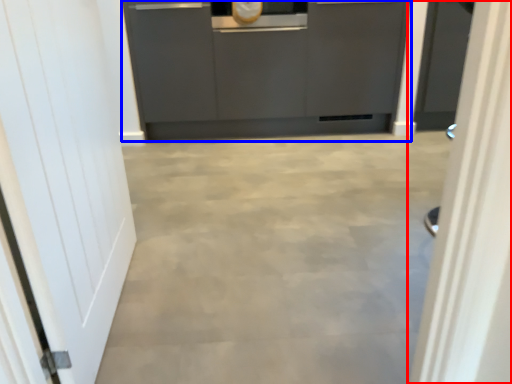
Question: Which object is closer to the camera taking this photo, door (highlighted by a red box) or cabinetry (highlighted by a blue box)?

Choices:
 (A) door
 (B) cabinetry

Answer: (A)